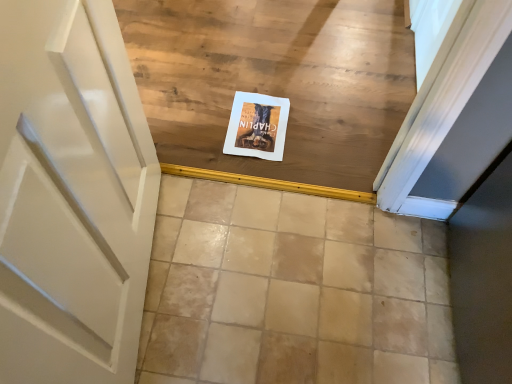
Question: Relative to white paper at center, is beige ceramic tile at center in front or behind?

Choices:
 (A) behind
 (B) front

Answer: (B)

Question: From the image's perspective, is beige ceramic tile at center located above or below white paper at center?

Choices:
 (A) above
 (B) below

Answer: (B)

Question: From a real-world perspective, is beige ceramic tile at center positioned above or below white paper at center?

Choices:
 (A) above
 (B) below

Answer: (B)

Question: In terms of height, does white paper at center look taller or shorter compared to beige ceramic tile at center?

Choices:
 (A) tall
 (B) short

Answer: (B)

Question: Considering their positions, is white paper at center located in front of or behind beige ceramic tile at center?

Choices:
 (A) front
 (B) behind

Answer: (B)

Question: Is point (287, 119) closer or farther from the camera than point (223, 355)?

Choices:
 (A) farther
 (B) closer

Answer: (A)

Question: Is white paper at center bigger or smaller than beige ceramic tile at center?

Choices:
 (A) small
 (B) big

Answer: (A)